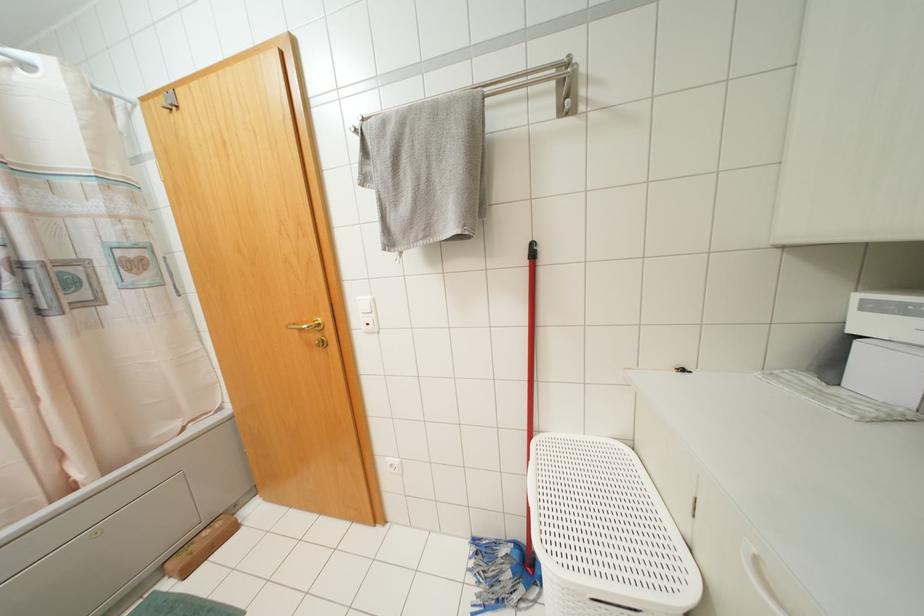
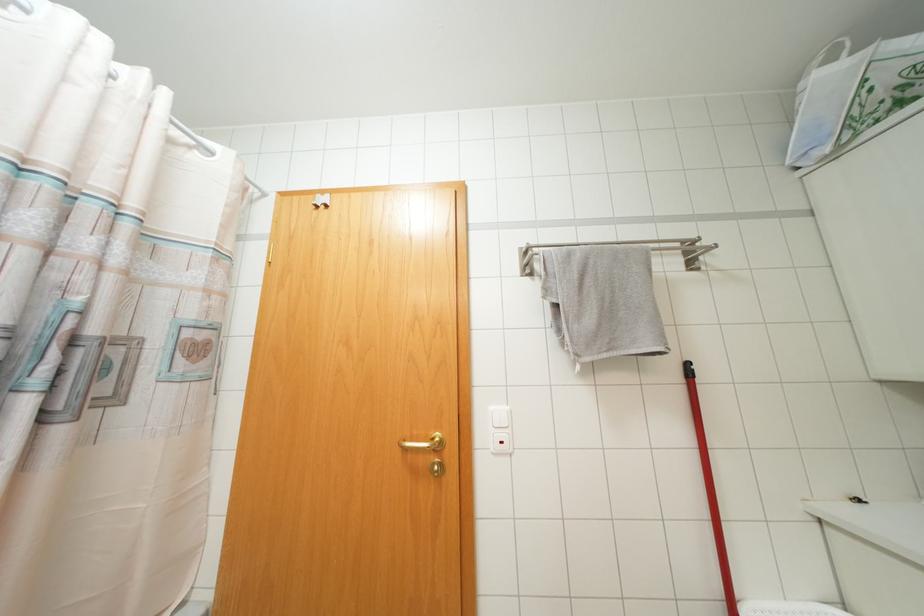
Question: How did the camera likely rotate?

Choices:
 (A) Left
 (B) Right
 (C) Up
 (D) Down

Answer: (C)